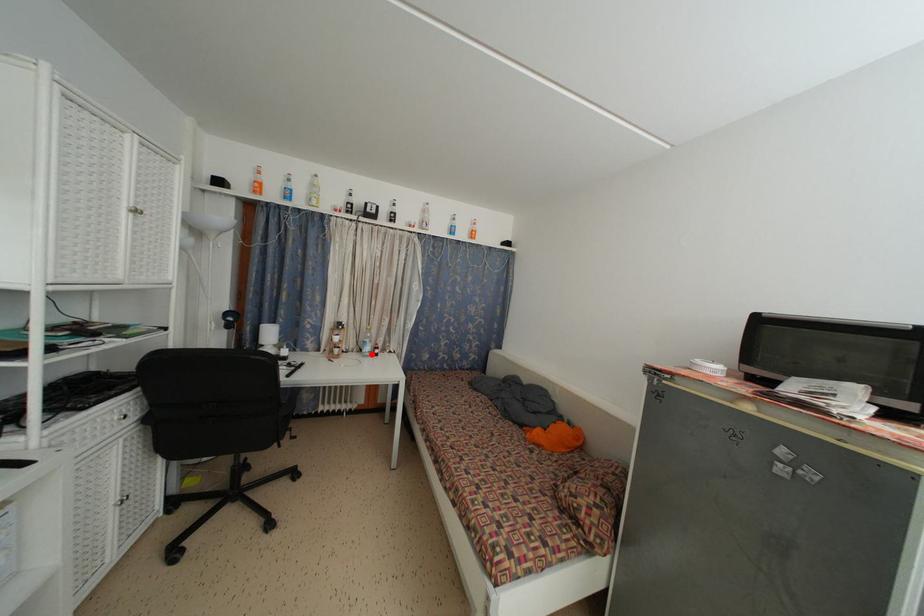
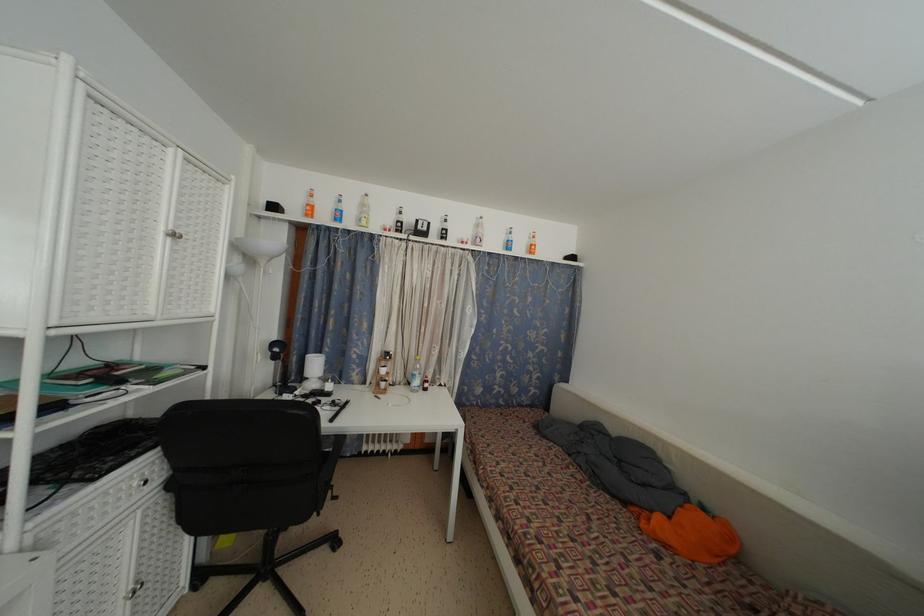
Find the pixel in the second image that matches the highlighted location in the first image.

(420, 387)